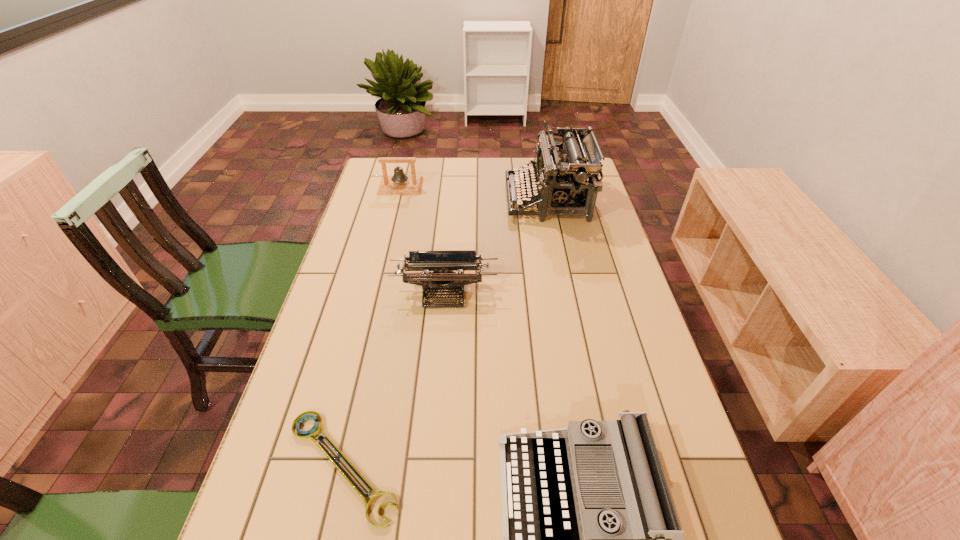
Where is `free region at the right edge`? The width and height of the screenshot is (960, 540). free region at the right edge is located at coordinates (631, 340).

The width and height of the screenshot is (960, 540). I want to click on vacant space at the far left corner of the desktop, so click(x=377, y=164).

Where is `free space between the bell and the tallest object`? free space between the bell and the tallest object is located at coordinates (474, 193).

The image size is (960, 540). Find the location of `free space between the third nearest object and the tallest object`. free space between the third nearest object and the tallest object is located at coordinates (495, 246).

Identify the location of free spot between the shortest object and the bell. (372, 326).

At what (x,y) coordinates should I click in order to perform the action: click on empty space that is in between the third nearest object and the wrench. Please return your answer as a coordinate pair (x, y). Looking at the image, I should click on (394, 379).

You are a GUI agent. You are given a task and a screenshot of the screen. Output one action in this format:
    pyautogui.click(x=<x>, y=<y>)
    Task: Click on the vacant space in between the bell and the shortest object
    This screenshot has width=960, height=540.
    Given the screenshot: What is the action you would take?
    pyautogui.click(x=372, y=326)

This screenshot has width=960, height=540. I want to click on unoccupied area between the wrench and the second nearest typewriter, so click(x=394, y=379).

Identify the location of vacant area that lies between the second farthest typewriter and the bell. (422, 239).

What are the coordinates of `empty space that is in between the farthest typewriter and the second nearest typewriter` in the screenshot? It's located at (495, 246).